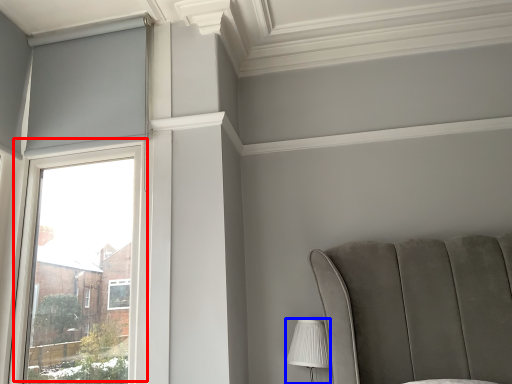
Question: Among these objects, which one is nearest to the camera, window (highlighted by a red box) or table lamp (highlighted by a blue box)?

Choices:
 (A) window
 (B) table lamp

Answer: (A)